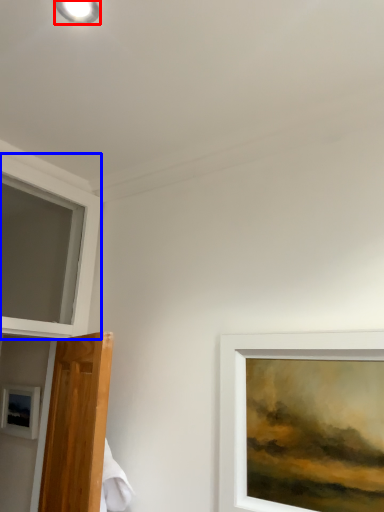
Question: Which object is closer to the camera taking this photo, droplight (highlighted by a red box) or window (highlighted by a blue box)?

Choices:
 (A) droplight
 (B) window

Answer: (A)